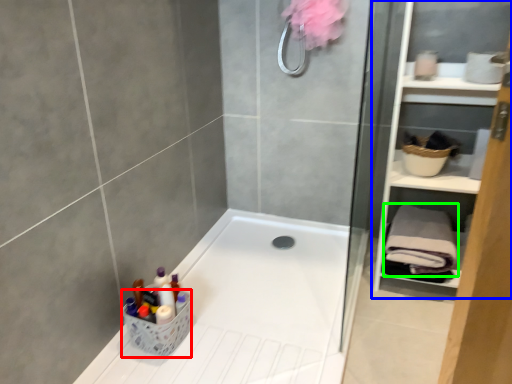
Question: Which object is positioned farthest from basket (highlighted by a red box)? Select from cabinet (highlighted by a blue box) and bath towel (highlighted by a green box).

Choices:
 (A) cabinet
 (B) bath towel

Answer: (A)